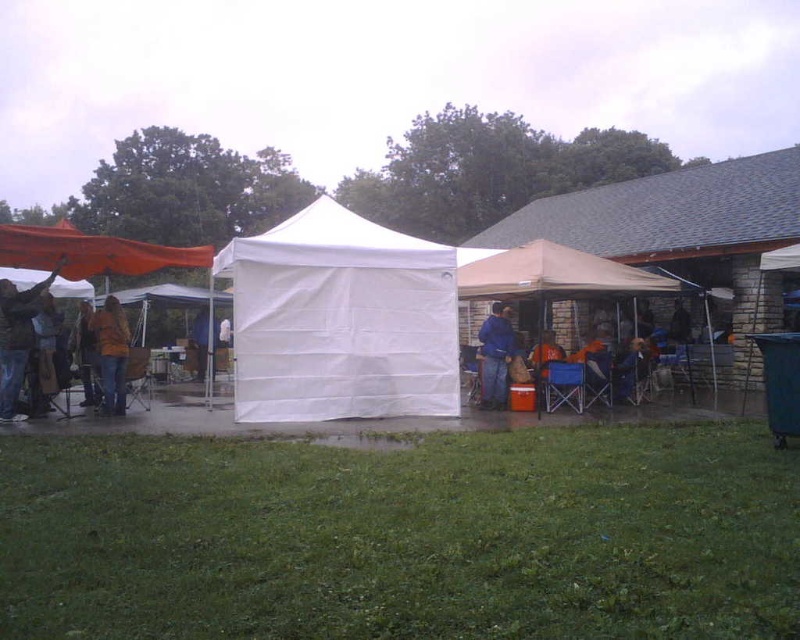
Question: Can you confirm if orange fabric canopy at left is positioned above blue denim jeans at center?

Choices:
 (A) no
 (B) yes

Answer: (B)

Question: Which object is farther from the camera taking this photo?

Choices:
 (A) brown leather jacket at center
 (B) jeans at left
 (C) blue denim jeans at center
 (D) tan fabric tent at center

Answer: (C)

Question: Does tan fabric tent at center appear over jeans at left?

Choices:
 (A) no
 (B) yes

Answer: (B)

Question: Does jeans at left appear on the right side of denim jacket at left?

Choices:
 (A) yes
 (B) no

Answer: (A)

Question: Which object is positioned closest to the denim jacket at left?

Choices:
 (A) jeans at left
 (B) brown leather jacket at center
 (C) white fabric canopy at center

Answer: (A)

Question: Which of the following is the farthest from the observer?

Choices:
 (A) (598, 266)
 (B) (214, 337)
 (C) (486, 337)
 (D) (117, 336)

Answer: (B)